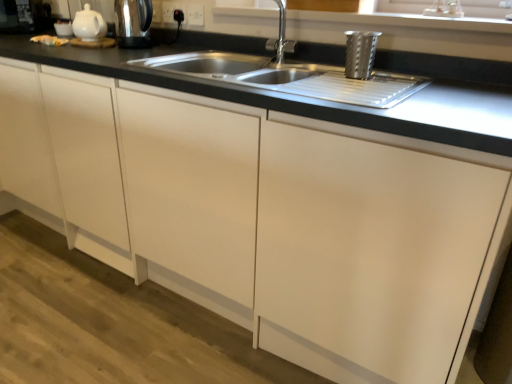
Measure the distance between point (184,7) and camera.

The distance of point (184,7) from camera is 1.89 meters.

Describe the element at coordinates (170, 11) in the screenshot. I see `black plastic socket at upper center, marked as the 2th electric outlet in a right-to-left arrangement` at that location.

This screenshot has height=384, width=512. Describe the element at coordinates (89, 25) in the screenshot. I see `white glossy teapot at upper left` at that location.

Where is `white glossy teapot at upper left`? The height and width of the screenshot is (384, 512). white glossy teapot at upper left is located at coordinates (89, 25).

Image resolution: width=512 pixels, height=384 pixels. I want to click on metallic stainless steel kettle at upper left, the second appliance in the bottom-to-top sequence, so click(133, 23).

Which of these two, white plastic electric outlet at upper center, which appears as the second electric outlet when viewed from the left, or satin nickel faucet at upper center, is wider?

Wider between the two is satin nickel faucet at upper center.

Which is closer to the camera, (195, 13) or (282, 49)?

Positioned in front is point (282, 49).

Which is correct: white plastic electric outlet at upper center, the first electric outlet from the right, is inside satin nickel faucet at upper center, or outside of it?

white plastic electric outlet at upper center, the first electric outlet from the right, is outside satin nickel faucet at upper center.

Considering the sizes of objects white plastic electric outlet at upper center, the first electric outlet from the right, and satin nickel faucet at upper center in the image provided, who is smaller, white plastic electric outlet at upper center, the first electric outlet from the right, or satin nickel faucet at upper center?

white plastic electric outlet at upper center, the first electric outlet from the right.

Consider the image. From a real-world perspective, is satin nickel faucet at upper center beneath white plastic electric outlet at upper center, the first electric outlet from the right?

Yes.

Is satin nickel faucet at upper center wider than white plastic electric outlet at upper center, which appears as the second electric outlet when viewed from the left?

Yes.

Is white plastic electric outlet at upper center, which appears as the second electric outlet when viewed from the left, located within satin nickel faucet at upper center?

No, white plastic electric outlet at upper center, which appears as the second electric outlet when viewed from the left, is not surrounded by satin nickel faucet at upper center.

Which object is closer to the camera taking this photo, satin nickel faucet at upper center or white plastic electric outlet at upper center, the first electric outlet from the right?

satin nickel faucet at upper center is closer to the camera.

Between metallic textured cup at upper right, arranged as the first appliance when ordered from the bottom, and black matte sink at center, which one is positioned behind?

metallic textured cup at upper right, arranged as the first appliance when ordered from the bottom, is further away from the camera.

Does metallic textured cup at upper right, marked as the first appliance in a front-to-back arrangement, have a lesser height compared to black matte sink at center?

No.

Does metallic textured cup at upper right, placed as the second appliance when sorted from top to bottom, have a greater width compared to black matte sink at center?

Incorrect, the width of metallic textured cup at upper right, placed as the second appliance when sorted from top to bottom, does not surpass that of black matte sink at center.

From the image's perspective, count 1st appliances upward from the black matte sink at center and point to it. Please provide its 2D coordinates.

[(360, 53)]

Considering the sizes of objects white glossy teapot at upper left and metallic stainless steel kettle at upper left, the second appliance in the bottom-to-top sequence, in the image provided, who is bigger, white glossy teapot at upper left or metallic stainless steel kettle at upper left, the second appliance in the bottom-to-top sequence,?

metallic stainless steel kettle at upper left, the second appliance in the bottom-to-top sequence, is bigger.

Is white glossy teapot at upper left looking in the opposite direction of metallic stainless steel kettle at upper left, the 2th appliance in the front-to-back sequence?

No, white glossy teapot at upper left is not facing the opposite direction of metallic stainless steel kettle at upper left, the 2th appliance in the front-to-back sequence.

Consider the image. From the image's perspective, is white glossy teapot at upper left positioned above or below metallic stainless steel kettle at upper left, which is the 1th appliance from top to bottom?

From the image's perspective, white glossy teapot at upper left appears above metallic stainless steel kettle at upper left, which is the 1th appliance from top to bottom.

What's the angular difference between white glossy teapot at upper left and black plastic socket at upper center, marked as the 2th electric outlet in a right-to-left arrangement,'s facing directions?

9.41 degrees.

Is white glossy teapot at upper left located outside black plastic socket at upper center, marked as the 2th electric outlet in a right-to-left arrangement?

Indeed, white glossy teapot at upper left is completely outside black plastic socket at upper center, marked as the 2th electric outlet in a right-to-left arrangement.

This screenshot has width=512, height=384. I want to click on the 2nd electric outlet positioned above the white glossy teapot at upper left (from the image's perspective), so click(170, 11).

From the picture: From a real-world perspective, does white glossy teapot at upper left sit lower than black plastic socket at upper center, marked as the 2th electric outlet in a right-to-left arrangement?

Yes, from a real-world perspective, white glossy teapot at upper left is under black plastic socket at upper center, marked as the 2th electric outlet in a right-to-left arrangement.

How different are the orientations of black matte sink at center and metallic stainless steel kettle at upper left, the second appliance in the bottom-to-top sequence, in degrees?

1.71 degrees.

Considering the sizes of objects black matte sink at center and metallic stainless steel kettle at upper left, the first appliance viewed from the back, in the image provided, who is smaller, black matte sink at center or metallic stainless steel kettle at upper left, the first appliance viewed from the back,?

With smaller size is metallic stainless steel kettle at upper left, the first appliance viewed from the back.

Is metallic stainless steel kettle at upper left, the second appliance in the bottom-to-top sequence, completely or partially inside black matte sink at center?

No, metallic stainless steel kettle at upper left, the second appliance in the bottom-to-top sequence, is not inside black matte sink at center.

Where is `appliance that is the 2nd object located above the black matte sink at center (from the image's perspective)`? This screenshot has width=512, height=384. appliance that is the 2nd object located above the black matte sink at center (from the image's perspective) is located at coordinates (133, 23).

From the black matte sink at center, count the 1st electric outlet to the left and point to it. Please provide its 2D coordinates.

[(195, 15)]

From their relative heights in the image, would you say black matte sink at center is taller or shorter than white plastic electric outlet at upper center, which appears as the second electric outlet when viewed from the left?

Considering their sizes, black matte sink at center has more height than white plastic electric outlet at upper center, which appears as the second electric outlet when viewed from the left.

Which of these two, black matte sink at center or white plastic electric outlet at upper center, the first electric outlet from the right, is bigger?

Bigger between the two is black matte sink at center.

Who is more distant, black matte sink at center or white plastic electric outlet at upper center, the first electric outlet from the right?

white plastic electric outlet at upper center, the first electric outlet from the right.

Find the location of `tap in front of the white plastic electric outlet at upper center, which appears as the second electric outlet when viewed from the left`. tap in front of the white plastic electric outlet at upper center, which appears as the second electric outlet when viewed from the left is located at coordinates (280, 38).

From the satin nickel faucet at upper center, count the 1st electric outlet to the left and point to it. Please provide its 2D coordinates.

[(195, 15)]

From the picture: Looking at the image, which one is located closer to black plastic socket at upper center, marked as the first electric outlet in a left-to-right arrangement, black matte sink at center or metallic stainless steel kettle at upper left, the 2th appliance in the front-to-back sequence?

Based on the image, metallic stainless steel kettle at upper left, the 2th appliance in the front-to-back sequence, appears to be nearer to black plastic socket at upper center, marked as the first electric outlet in a left-to-right arrangement.

From the image, which object appears to be farther from white plastic electric outlet at upper center, which appears as the second electric outlet when viewed from the left, satin nickel faucet at upper center or black matte sink at center?

The object further to white plastic electric outlet at upper center, which appears as the second electric outlet when viewed from the left, is black matte sink at center.

Based on their spatial positions, is black plastic socket at upper center, marked as the 2th electric outlet in a right-to-left arrangement, or metallic textured cup at upper right, acting as the second appliance starting from the back, further from white glossy teapot at upper left?

The object further to white glossy teapot at upper left is metallic textured cup at upper right, acting as the second appliance starting from the back.

From the image, which object appears to be farther from black plastic socket at upper center, marked as the first electric outlet in a left-to-right arrangement, metallic textured cup at upper right, acting as the second appliance starting from the back, or white glossy teapot at upper left?

metallic textured cup at upper right, acting as the second appliance starting from the back, lies further to black plastic socket at upper center, marked as the first electric outlet in a left-to-right arrangement, than the other object.

Consider the image. From the image, which object appears to be farther from metallic stainless steel kettle at upper left, the first appliance viewed from the back, white plastic electric outlet at upper center, the first electric outlet from the right, or white glossy teapot at upper left?

white plastic electric outlet at upper center, the first electric outlet from the right, lies further to metallic stainless steel kettle at upper left, the first appliance viewed from the back, than the other object.

Considering their positions, is metallic stainless steel kettle at upper left, the second appliance when ordered from right to left, positioned closer to satin nickel faucet at upper center than metallic textured cup at upper right, marked as the second appliance in a left-to-right arrangement?

metallic textured cup at upper right, marked as the second appliance in a left-to-right arrangement, is positioned closer to the anchor satin nickel faucet at upper center.

From the image, which object appears to be farther from satin nickel faucet at upper center, white glossy teapot at upper left or metallic stainless steel kettle at upper left, which is the 1th appliance from top to bottom?

white glossy teapot at upper left.

From the image, which object appears to be farther from black plastic socket at upper center, marked as the 2th electric outlet in a right-to-left arrangement, white plastic electric outlet at upper center, the first electric outlet from the right, or black matte sink at center?

Among the two, black matte sink at center is located further to black plastic socket at upper center, marked as the 2th electric outlet in a right-to-left arrangement.

Locate an element on the screen. The height and width of the screenshot is (384, 512). tea pot positioned between black matte sink at center and black plastic socket at upper center, marked as the first electric outlet in a left-to-right arrangement, from near to far is located at coordinates (89, 25).

Locate an element on the screen. This screenshot has width=512, height=384. appliance between white glossy teapot at upper left and black matte sink at center in the horizontal direction is located at coordinates (133, 23).

Image resolution: width=512 pixels, height=384 pixels. I want to click on electric outlet between black plastic socket at upper center, marked as the 2th electric outlet in a right-to-left arrangement, and metallic textured cup at upper right, marked as the second appliance in a left-to-right arrangement, in the horizontal direction, so click(x=195, y=15).

What are the coordinates of `tap between black matte sink at center and white plastic electric outlet at upper center, the first electric outlet from the right, from front to back` in the screenshot? It's located at (280, 38).